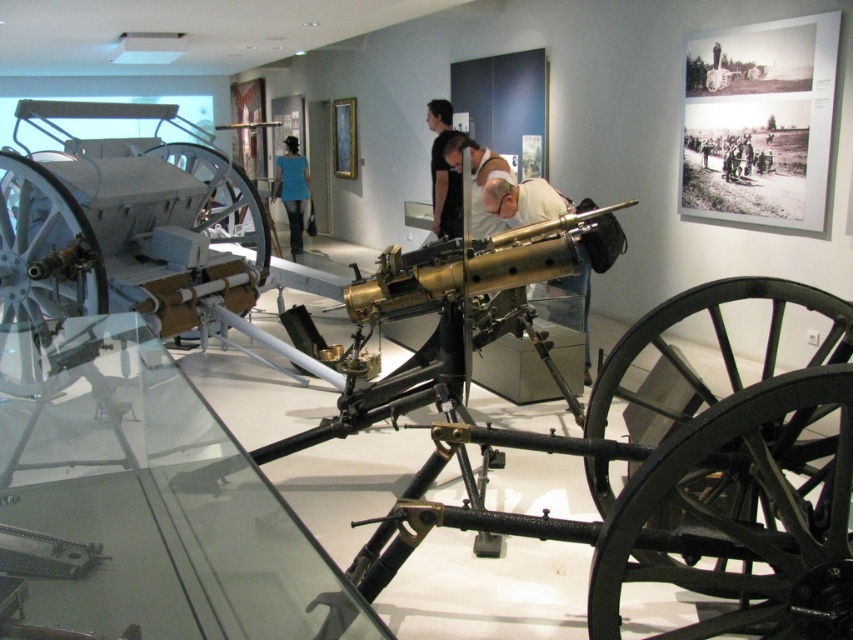
Question: In this image, where is brown leather jacket at center located relative to blue fabric shirt at center?

Choices:
 (A) left
 (B) right

Answer: (B)

Question: Which point is closer to the camera?

Choices:
 (A) (286, 144)
 (B) (751, 144)

Answer: (B)

Question: Which of these objects is positioned closest to the transparent glass table at center?

Choices:
 (A) black matte shirt at center
 (B) metallic gold machine gun at center

Answer: (B)

Question: Is metallic gold machine gun at center to the right of blue fabric shirt at center from the viewer's perspective?

Choices:
 (A) yes
 (B) no

Answer: (A)

Question: Can you confirm if metallic gold machine gun at center is positioned above brown leather jacket at center?

Choices:
 (A) yes
 (B) no

Answer: (B)

Question: Which object appears closest to the camera in this image?

Choices:
 (A) metallic gold machine gun at center
 (B) black matte shirt at center
 (C) brown leather jacket at center
 (D) transparent glass table at center

Answer: (D)